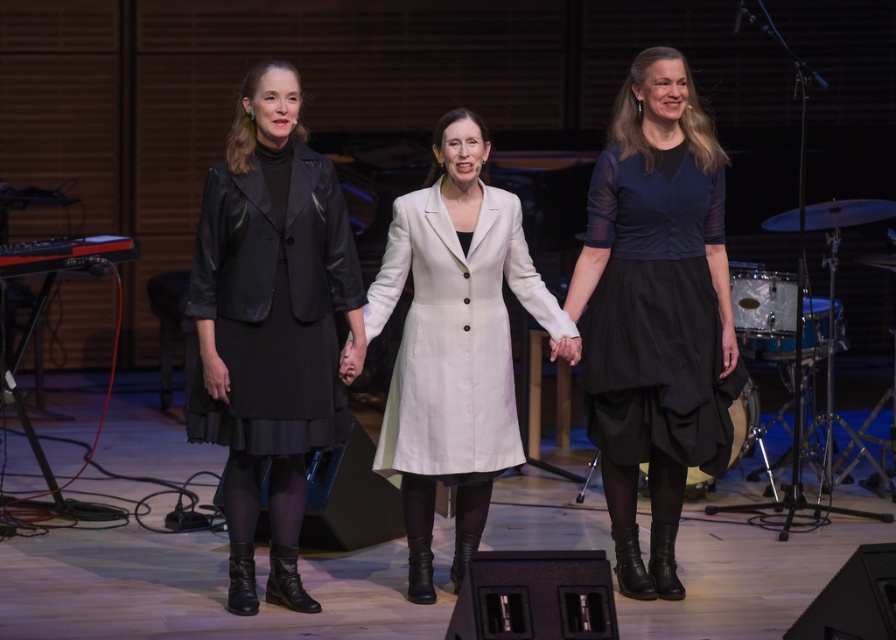
You are a photographer trying to capture a closeup of the black leather jacket at center and the white fabric coat at center. Since you want to focus on both, which jacket should you zoom in on to ensure both are in frame without moving the camera?

The black leather jacket at center has a smaller width than the white fabric coat at center, so you should zoom in on the white fabric coat at center to accommodate both in the frame.

You are standing in the concert hall and want to reach the point marked at coordinates (690, 353). If your walking distance is limited to 5 meters, can you reach that point without moving further away?

The distance of point (690, 353) from viewer is 5.19 meters, which exceeds your 5 meter limit. You cannot reach it without going beyond your walking distance.

You are a photographer in a concert hall. You need to capture a photo of the matte black dress at right and the white fabric coat at center. Based on their positions, which one is higher in the frame?

The matte black dress at right is above the white fabric coat at center, so it is higher in the frame.